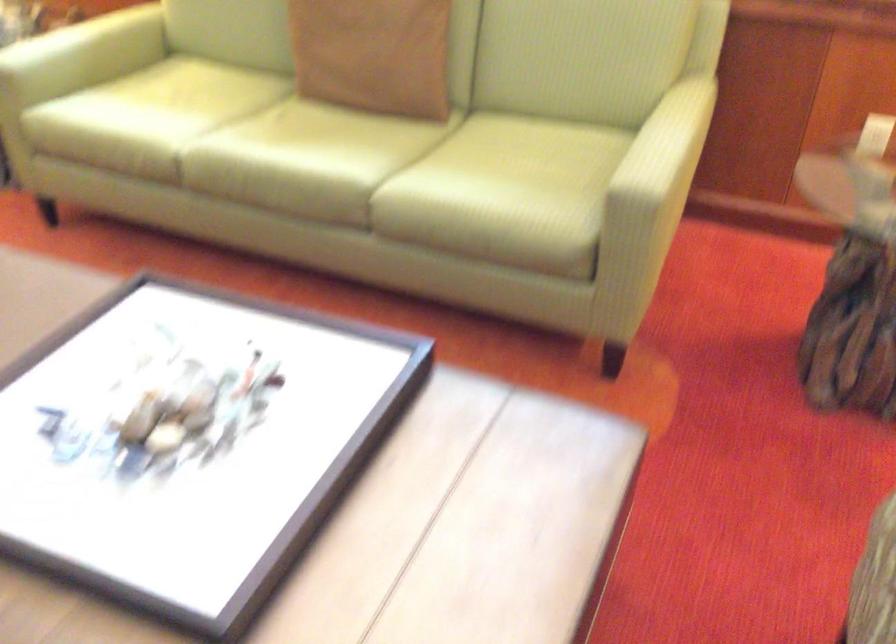
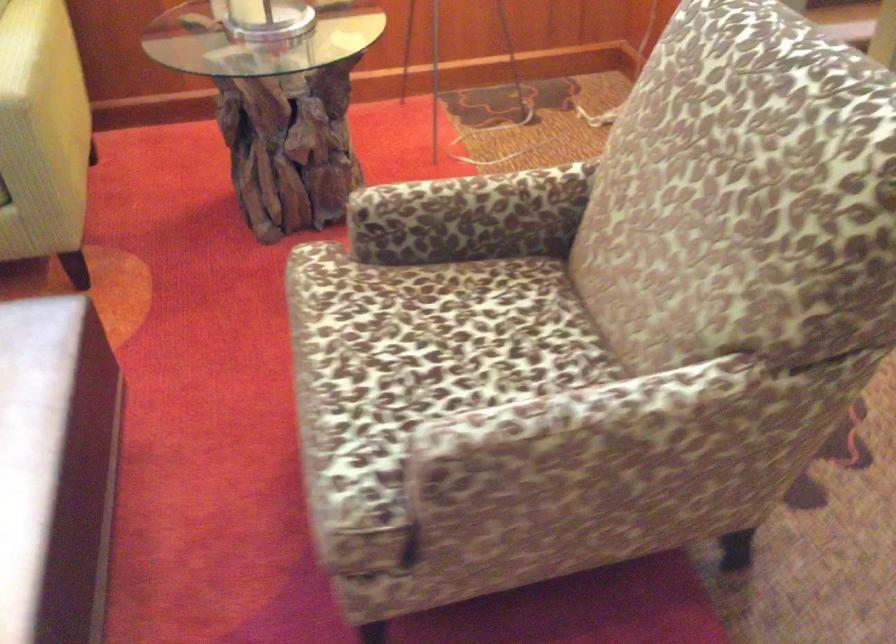
Question: The first image is from the beginning of the video and the second image is from the end. How did the camera likely rotate when shooting the video?

Choices:
 (A) Left
 (B) Right
 (C) Up
 (D) Down

Answer: (B)